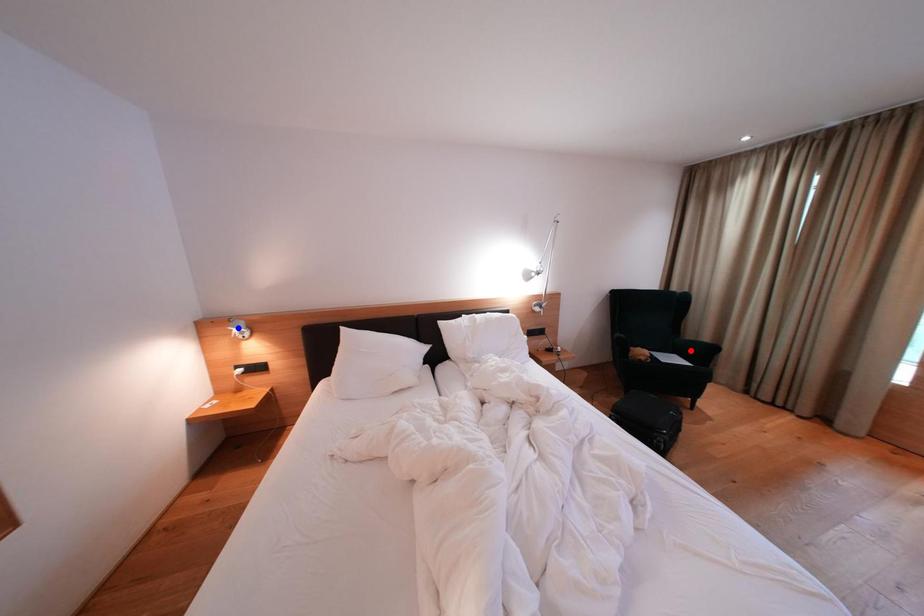
Question: Which of the two points in the image is closer to the camera?

Choices:
 (A) Blue point is closer.
 (B) Red point is closer.

Answer: (A)